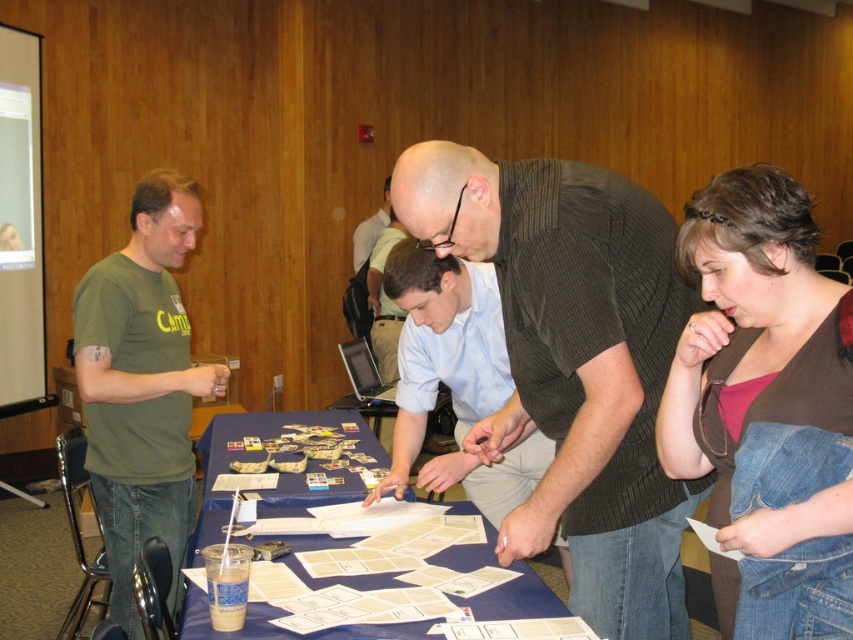
Question: Can you confirm if green matte t-shirt at left is smaller than matte black shirt at center?

Choices:
 (A) yes
 (B) no

Answer: (B)

Question: Does dark brown textured shirt at center appear under brown denim jacket at lower right?

Choices:
 (A) yes
 (B) no

Answer: (A)

Question: Does dark brown textured shirt at center have a lesser width compared to blue paperboard at center?

Choices:
 (A) no
 (B) yes

Answer: (B)

Question: Among these points, which one is farthest from the camera?

Choices:
 (A) (749, 634)
 (B) (387, 221)

Answer: (B)

Question: Which object appears closest to the camera in this image?

Choices:
 (A) light blue shirt at center
 (B) brown denim jacket at lower right
 (C) green matte t-shirt at left

Answer: (B)

Question: Which point is closer to the camera?

Choices:
 (A) (160, 244)
 (B) (540, 467)
 (C) (844, 388)
 (D) (668, 257)

Answer: (C)